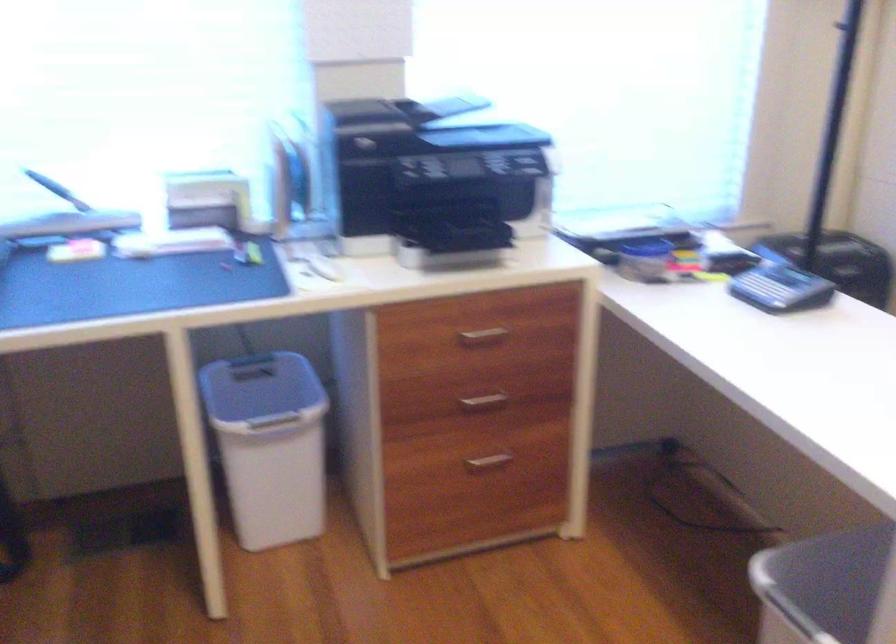
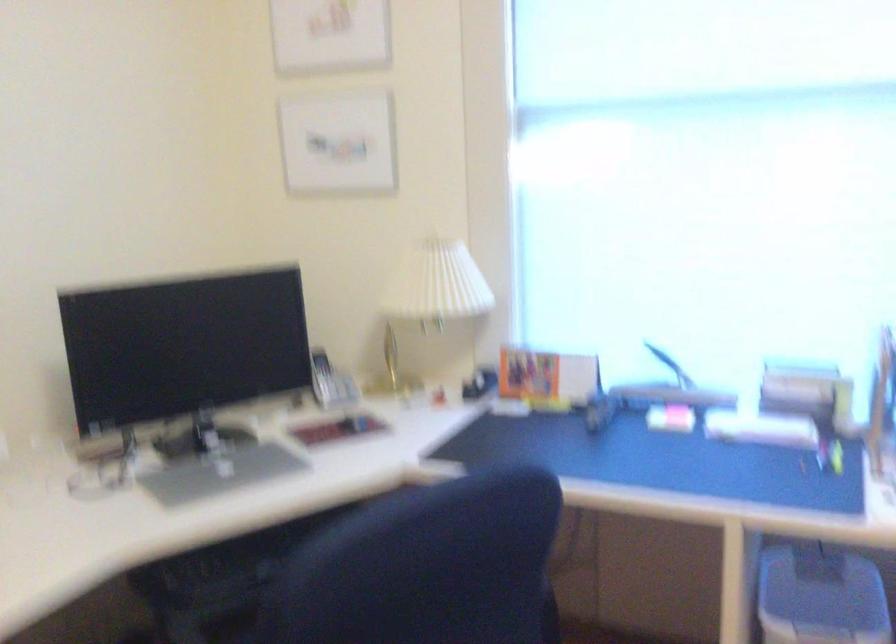
Question: The camera is either moving clockwise (left) or counter-clockwise (right) around the object. The first image is from the beginning of the video and the second image is from the end. Is the camera moving left or right when shooting the video?

Choices:
 (A) Left
 (B) Right

Answer: (B)